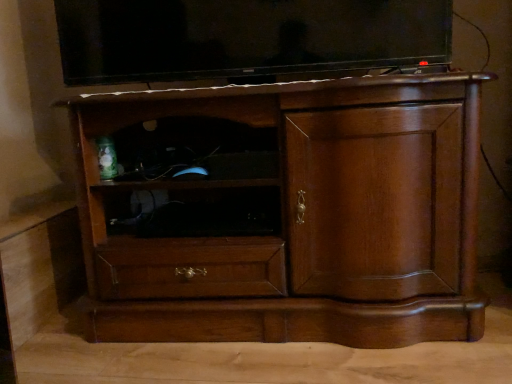
What do you see at coordinates (285, 212) in the screenshot?
I see `brown wood cabinet at center` at bounding box center [285, 212].

What do you see at coordinates (192, 211) in the screenshot?
I see `black matte shelf at center` at bounding box center [192, 211].

Describe the element at coordinates (245, 38) in the screenshot. I see `matte black tv at upper center` at that location.

At what (x,y) coordinates should I click in order to perform the action: click on brown wood cabinet at center. Please return your answer as a coordinate pair (x, y). Looking at the image, I should click on (285, 212).

In the scene shown: From the image's perspective, is matte black tv at upper center located above or below brown wood cabinet at center?

Based on their image positions, matte black tv at upper center is located above brown wood cabinet at center.

Is matte black tv at upper center positioned with its back to brown wood cabinet at center?

matte black tv at upper center is not turned away from brown wood cabinet at center.

Considering the sizes of objects matte black tv at upper center and brown wood cabinet at center in the image provided, who is bigger, matte black tv at upper center or brown wood cabinet at center?

With larger size is brown wood cabinet at center.

Can you confirm if matte black tv at upper center is thinner than brown wood cabinet at center?

Indeed, matte black tv at upper center has a lesser width compared to brown wood cabinet at center.

From the image's perspective, is brown wood cabinet at center below black matte shelf at center?

Incorrect, from the image's perspective, brown wood cabinet at center is higher than black matte shelf at center.

Is there a large distance between brown wood cabinet at center and black matte shelf at center?

No, there isn't a large distance between brown wood cabinet at center and black matte shelf at center.

Would you say brown wood cabinet at center is outside black matte shelf at center?

Yes, brown wood cabinet at center is not within black matte shelf at center.

Is brown wood cabinet at center wider than black matte shelf at center?

Yes, brown wood cabinet at center is wider than black matte shelf at center.

How different are the orientations of black matte shelf at center and brown wood cabinet at center in degrees?

The angle between the facing direction of black matte shelf at center and the facing direction of brown wood cabinet at center is 2.19 degrees.

The width and height of the screenshot is (512, 384). I want to click on the chest of drawers in front of the black matte shelf at center, so click(x=285, y=212).

Considering the positions of points (225, 207) and (452, 319), is point (225, 207) farther from camera compared to point (452, 319)?

Yes, it is behind point (452, 319).

Is black matte shelf at center in contact with brown wood cabinet at center?

They are not placed beside each other.

Is matte black tv at upper center completely or partially outside of black matte shelf at center?

matte black tv at upper center is positioned outside black matte shelf at center.

Does matte black tv at upper center have a smaller size compared to black matte shelf at center?

No.

Between matte black tv at upper center and black matte shelf at center, which one is positioned in front?

matte black tv at upper center.

From the image's perspective, who appears lower, matte black tv at upper center or black matte shelf at center?

black matte shelf at center.

Looking at this image, from the image's perspective, relative to matte black tv at upper center, is brown wood cabinet at center above or below?

brown wood cabinet at center is situated lower than matte black tv at upper center in the image.

From a real-world perspective, who is located higher, brown wood cabinet at center or matte black tv at upper center?

matte black tv at upper center.

Image resolution: width=512 pixels, height=384 pixels. What are the coordinates of `the chest of drawers that appears in front of the matte black tv at upper center` in the screenshot? It's located at (285, 212).

Which object is thinner, brown wood cabinet at center or matte black tv at upper center?

matte black tv at upper center.

Find the location of a particular element. Image resolution: width=512 pixels, height=384 pixels. shelf below the matte black tv at upper center (from the image's perspective) is located at coordinates (192, 211).

Measure the distance between black matte shelf at center and matte black tv at upper center.

black matte shelf at center is 44.83 centimeters away from matte black tv at upper center.

Between black matte shelf at center and matte black tv at upper center, which one has larger size?

matte black tv at upper center.

Is black matte shelf at center far from matte black tv at upper center?

That's not correct — black matte shelf at center is a little close to matte black tv at upper center.

Where is `television behind the brown wood cabinet at center`? Image resolution: width=512 pixels, height=384 pixels. television behind the brown wood cabinet at center is located at coordinates (245, 38).

What are the coordinates of `shelf directly beneath the brown wood cabinet at center (from a real-world perspective)` in the screenshot? It's located at (192, 211).

Estimate the real-world distances between objects in this image. Which object is further from brown wood cabinet at center, matte black tv at upper center or black matte shelf at center?

The object further to brown wood cabinet at center is matte black tv at upper center.

When comparing their distances from black matte shelf at center, does matte black tv at upper center or brown wood cabinet at center seem closer?

The object closer to black matte shelf at center is brown wood cabinet at center.

In the scene shown: When comparing their distances from brown wood cabinet at center, does black matte shelf at center or matte black tv at upper center seem further?

Among the two, matte black tv at upper center is located further to brown wood cabinet at center.

Considering their positions, is brown wood cabinet at center positioned closer to black matte shelf at center than matte black tv at upper center?

brown wood cabinet at center.

Estimate the real-world distances between objects in this image. Which object is closer to matte black tv at upper center, black matte shelf at center or brown wood cabinet at center?

brown wood cabinet at center is closer to matte black tv at upper center.

Based on their spatial positions, is brown wood cabinet at center or black matte shelf at center closer to matte black tv at upper center?

The object closer to matte black tv at upper center is brown wood cabinet at center.

Where is `the chest of drawers that lies between matte black tv at upper center and black matte shelf at center from top to bottom`? the chest of drawers that lies between matte black tv at upper center and black matte shelf at center from top to bottom is located at coordinates (285, 212).